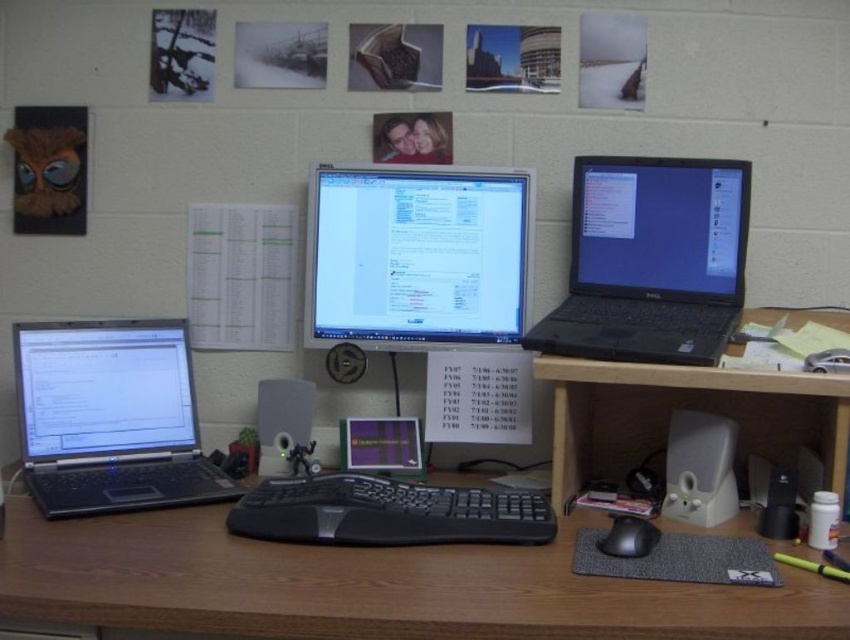
Can you confirm if green paper at center is taller than black matte mouse at center?

Indeed, green paper at center has a greater height compared to black matte mouse at center.

Between point (241, 317) and point (629, 525), which one is positioned behind?

Point (241, 317)

Describe the element at coordinates (241, 276) in the screenshot. I see `green paper at center` at that location.

Where is `green paper at center`? Image resolution: width=850 pixels, height=640 pixels. green paper at center is located at coordinates tap(241, 276).

The width and height of the screenshot is (850, 640). Describe the element at coordinates (417, 257) in the screenshot. I see `matte black monitor at center` at that location.

Is matte black monitor at center positioned behind black plastic laptop at upper right?

Yes.

Is point (330, 282) positioned in front of point (680, 184)?

No, (330, 282) is behind (680, 184).

This screenshot has height=640, width=850. What are the coordinates of `matte black monitor at center` in the screenshot? It's located at [417, 257].

Is point (499, 627) positioned before point (238, 513)?

Yes, it is.

Describe the element at coordinates (367, 588) in the screenshot. I see `wooden at center` at that location.

This screenshot has height=640, width=850. I want to click on wooden at center, so click(367, 588).

Locate an element on the screen. The height and width of the screenshot is (640, 850). wooden at center is located at coordinates (367, 588).